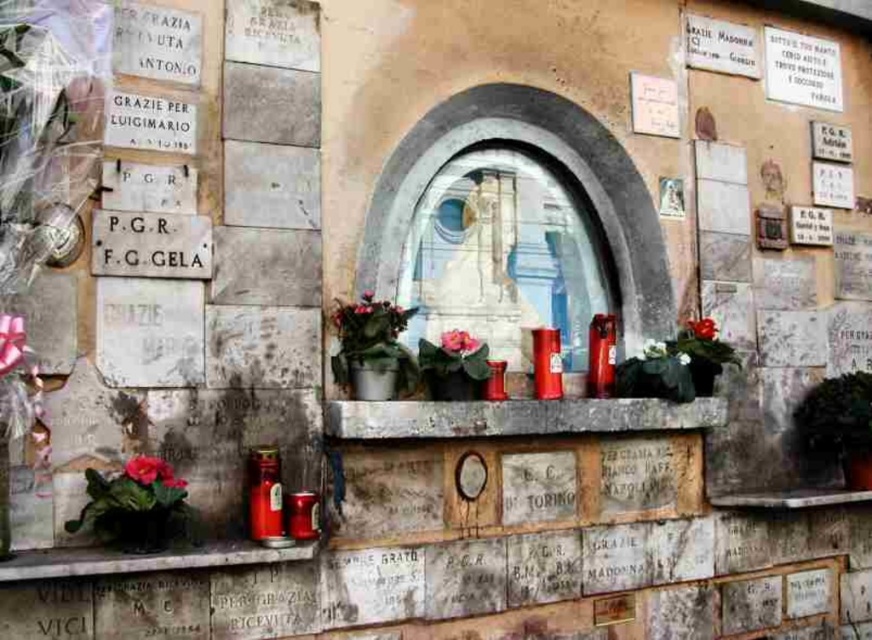
Question: Is white paper sign at upper right above matte pink flower at lower left?

Choices:
 (A) no
 (B) yes

Answer: (B)

Question: Observing the image, what is the correct spatial positioning of pink matte flower at center in reference to matte green plant at center?

Choices:
 (A) above
 (B) below

Answer: (B)

Question: Which of these objects is positioned closest to the white paper sign at upper right?

Choices:
 (A) smooth concrete ledge at center
 (B) matte concrete ledge at lower left

Answer: (A)

Question: Can you confirm if white stone plaque at left is positioned above smooth concrete ledge at center?

Choices:
 (A) no
 (B) yes

Answer: (B)

Question: Which point is farther to the camera?

Choices:
 (A) (665, 352)
 (B) (201, 556)

Answer: (A)

Question: Among these points, which one is farthest from the camera?

Choices:
 (A) (445, 339)
 (B) (112, 234)
 (C) (420, 429)

Answer: (A)